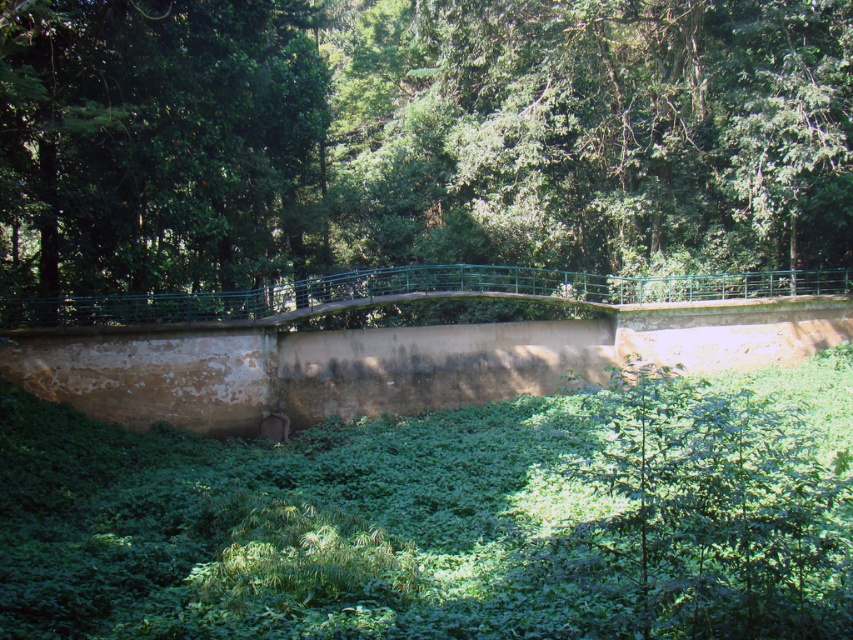
Looking at this image, who is shorter, green metallic bridge at center or green leafy vegetation at center?

green leafy vegetation at center is shorter.

Is point (291, 100) in front of point (434, 432)?

No.

Who is more forward, (131,220) or (184,440)?

Point (184,440)

Find the location of a particular element. The image size is (853, 640). green metallic bridge at center is located at coordinates (416, 138).

Which of these two, green metallic bridge at center or green leafy tree at center, stands taller?

Standing taller between the two is green metallic bridge at center.

Can you confirm if green metallic bridge at center is positioned above green leafy tree at center?

Indeed, green metallic bridge at center is positioned over green leafy tree at center.

Who is more distant from viewer, [274,116] or [310,90]?

Positioned behind is point [310,90].

Find the location of a particular element. green metallic bridge at center is located at coordinates (416, 138).

Is point (213, 628) positioned before point (131, 177)?

Yes, point (213, 628) is closer to viewer.

Is point (613, 492) positioned in front of point (300, 92)?

That is True.

Identify the location of green leafy vegetation at center. Image resolution: width=853 pixels, height=640 pixels. (445, 518).